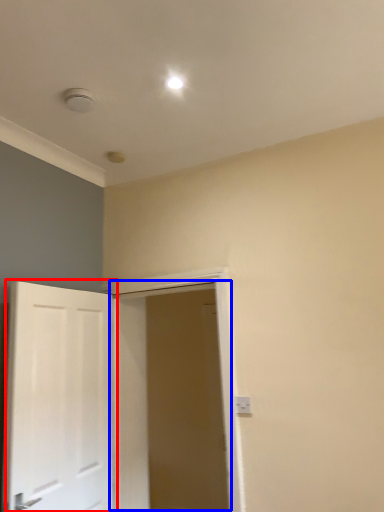
Question: Among these objects, which one is farthest to the camera, door (highlighted by a red box) or door (highlighted by a blue box)?

Choices:
 (A) door
 (B) door

Answer: (B)